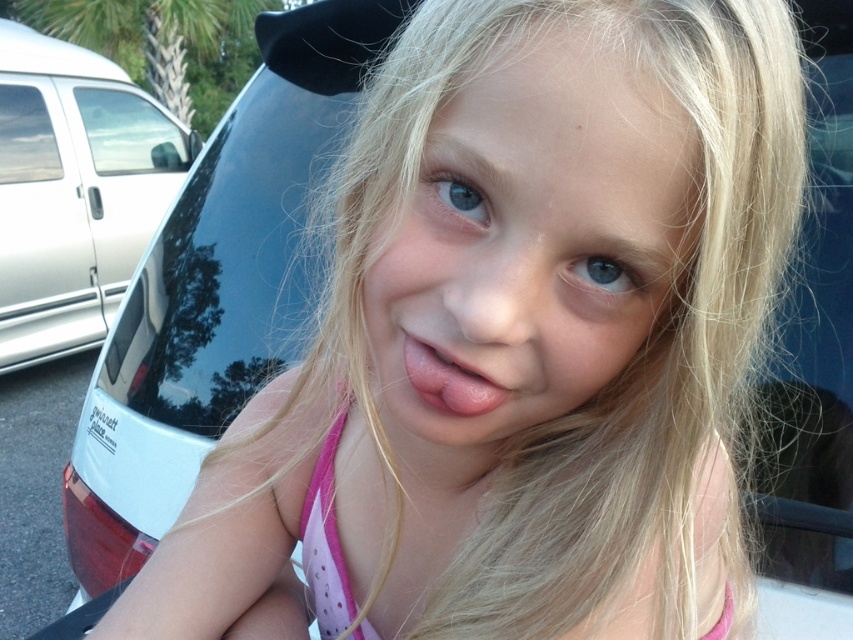
You are a photographer trying to capture the girl through the windows in the background. Which window, the transparent glass car window at upper left or the transparent glass window at upper left, would allow you to see the girl more clearly?

The transparent glass car window at upper left is larger in size than the transparent glass window at upper left, so it would allow you to see the girl more clearly.